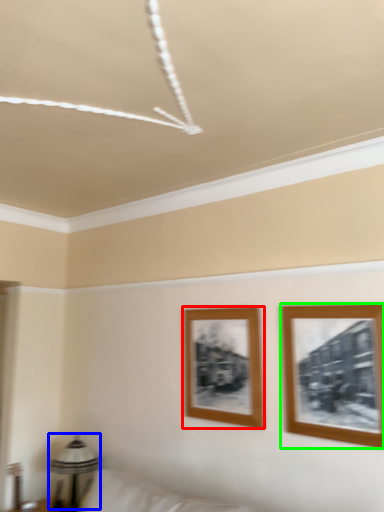
Question: Which object is positioned closest to picture frame (highlighted by a red box)? Select from table lamp (highlighted by a blue box) and picture frame (highlighted by a green box).

Choices:
 (A) table lamp
 (B) picture frame

Answer: (B)